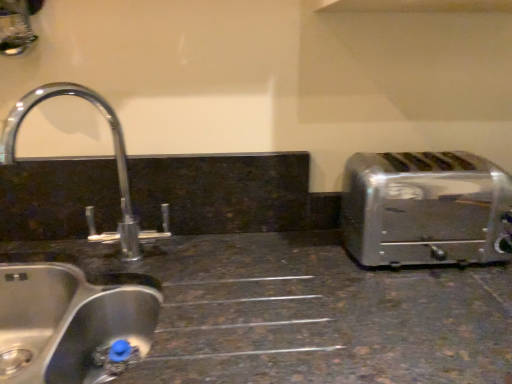
This screenshot has width=512, height=384. Describe the element at coordinates (425, 209) in the screenshot. I see `satin silver toaster at right` at that location.

The height and width of the screenshot is (384, 512). Identify the location of satin silver toaster at right. (425, 209).

Considering the positions of objects stainless steel sink at lower left, the 2th sink viewed from the top, and satin silver toaster at right in the image provided, who is more to the left, stainless steel sink at lower left, the 2th sink viewed from the top, or satin silver toaster at right?

Positioned to the left is stainless steel sink at lower left, the 2th sink viewed from the top.

Who is bigger, stainless steel sink at lower left, which is the first sink in bottom-to-top order, or satin silver toaster at right?

Bigger between the two is stainless steel sink at lower left, which is the first sink in bottom-to-top order.

Which of these two, stainless steel sink at lower left, the 2th sink viewed from the top, or satin silver toaster at right, stands taller?

stainless steel sink at lower left, the 2th sink viewed from the top, is taller.

Is brushed metal sink at left, which is the first sink in top-to-bottom order, outside of stainless steel sink at lower left, which is the first sink in bottom-to-top order?

brushed metal sink at left, which is the first sink in top-to-bottom order, lies outside stainless steel sink at lower left, which is the first sink in bottom-to-top order,'s area.

From the image's perspective, who appears lower, brushed metal sink at left, which is the first sink in top-to-bottom order, or stainless steel sink at lower left, which is the first sink in bottom-to-top order?

stainless steel sink at lower left, which is the first sink in bottom-to-top order, is shown below in the image.

Which object is thinner, brushed metal sink at left, arranged as the 2th sink when ordered from the bottom, or stainless steel sink at lower left, the 2th sink viewed from the top?

Thinner between the two is brushed metal sink at left, arranged as the 2th sink when ordered from the bottom.

How far apart are brushed metal sink at left, arranged as the 2th sink when ordered from the bottom, and stainless steel sink at lower left, which is the first sink in bottom-to-top order?

brushed metal sink at left, arranged as the 2th sink when ordered from the bottom, and stainless steel sink at lower left, which is the first sink in bottom-to-top order, are 1.48 inches apart from each other.

Measure the distance between satin silver toaster at right and stainless steel sink at lower left, which is the first sink in bottom-to-top order.

The distance of satin silver toaster at right from stainless steel sink at lower left, which is the first sink in bottom-to-top order, is 23.37 inches.

Is satin silver toaster at right next to stainless steel sink at lower left, the 2th sink viewed from the top?

satin silver toaster at right and stainless steel sink at lower left, the 2th sink viewed from the top, are not in contact.

Is satin silver toaster at right closer to camera compared to stainless steel sink at lower left, which is the first sink in bottom-to-top order?

No, satin silver toaster at right is behind stainless steel sink at lower left, which is the first sink in bottom-to-top order.

From a real-world perspective, between satin silver toaster at right and stainless steel sink at lower left, which is the first sink in bottom-to-top order, who is vertically lower?

From a 3D spatial view, stainless steel sink at lower left, which is the first sink in bottom-to-top order, is below.

Where is `sink lying above the stainless steel sink at lower left, the 2th sink viewed from the top (from the image's perspective)`? sink lying above the stainless steel sink at lower left, the 2th sink viewed from the top (from the image's perspective) is located at coordinates (70, 325).

Measure the distance between stainless steel sink at lower left, the 2th sink viewed from the top, and brushed metal sink at left, arranged as the 2th sink when ordered from the bottom.

1.48 inches.

From the picture: Who is more distant, stainless steel sink at lower left, the 2th sink viewed from the top, or brushed metal sink at left, arranged as the 2th sink when ordered from the bottom?

Positioned behind is brushed metal sink at left, arranged as the 2th sink when ordered from the bottom.

Is stainless steel sink at lower left, which is the first sink in bottom-to-top order, looking in the opposite direction of brushed metal sink at left, which is the first sink in top-to-bottom order?

That's not correct — stainless steel sink at lower left, which is the first sink in bottom-to-top order, is not looking away from brushed metal sink at left, which is the first sink in top-to-bottom order.

Is brushed metal sink at left, arranged as the 2th sink when ordered from the bottom, next to satin silver toaster at right and touching it?

No, brushed metal sink at left, arranged as the 2th sink when ordered from the bottom, is not with satin silver toaster at right.

Which of these two, brushed metal sink at left, arranged as the 2th sink when ordered from the bottom, or satin silver toaster at right, is thinner?

brushed metal sink at left, arranged as the 2th sink when ordered from the bottom.

Between point (11, 126) and point (421, 226), which one is positioned behind?

The point (421, 226) is farther.

Considering the sizes of objects satin silver toaster at right and brushed metal sink at left, arranged as the 2th sink when ordered from the bottom, in the image provided, who is shorter, satin silver toaster at right or brushed metal sink at left, arranged as the 2th sink when ordered from the bottom,?

satin silver toaster at right is shorter.

Find the location of a particular element. Image resolution: width=512 pixels, height=384 pixels. the 1st sink to the left when counting from the satin silver toaster at right is located at coordinates (70, 325).

Is satin silver toaster at right turned away from brushed metal sink at left, which is the first sink in top-to-bottom order?

No, satin silver toaster at right is not facing away from brushed metal sink at left, which is the first sink in top-to-bottom order.

I want to click on sink located underneath the satin silver toaster at right (from a real-world perspective), so click(x=73, y=323).

The width and height of the screenshot is (512, 384). What are the coordinates of `sink on the right of stainless steel sink at lower left, which is the first sink in bottom-to-top order` in the screenshot? It's located at (70, 325).

Which object lies further to the anchor point brushed metal sink at left, arranged as the 2th sink when ordered from the bottom, stainless steel sink at lower left, the 2th sink viewed from the top, or satin silver toaster at right?

satin silver toaster at right is further to brushed metal sink at left, arranged as the 2th sink when ordered from the bottom.

Estimate the real-world distances between objects in this image. Which object is further from brushed metal sink at left, arranged as the 2th sink when ordered from the bottom, satin silver toaster at right or stainless steel sink at lower left, which is the first sink in bottom-to-top order?

The object further to brushed metal sink at left, arranged as the 2th sink when ordered from the bottom, is satin silver toaster at right.

Looking at the image, which one is located closer to stainless steel sink at lower left, which is the first sink in bottom-to-top order, brushed metal sink at left, arranged as the 2th sink when ordered from the bottom, or satin silver toaster at right?

brushed metal sink at left, arranged as the 2th sink when ordered from the bottom.

Based on their spatial positions, is satin silver toaster at right or brushed metal sink at left, arranged as the 2th sink when ordered from the bottom, closer to stainless steel sink at lower left, the 2th sink viewed from the top?

brushed metal sink at left, arranged as the 2th sink when ordered from the bottom, is positioned closer to the anchor stainless steel sink at lower left, the 2th sink viewed from the top.

Which object lies nearer to the anchor point satin silver toaster at right, stainless steel sink at lower left, the 2th sink viewed from the top, or brushed metal sink at left, arranged as the 2th sink when ordered from the bottom?

The object closer to satin silver toaster at right is stainless steel sink at lower left, the 2th sink viewed from the top.

Looking at the image, which one is located closer to satin silver toaster at right, brushed metal sink at left, which is the first sink in top-to-bottom order, or stainless steel sink at lower left, which is the first sink in bottom-to-top order?

The object closer to satin silver toaster at right is stainless steel sink at lower left, which is the first sink in bottom-to-top order.

You are a GUI agent. You are given a task and a screenshot of the screen. Output one action in this format:
    pyautogui.click(x=<x>, y=<y>)
    Task: Click on the sink between stainless steel sink at lower left, which is the first sink in bottom-to-top order, and satin silver toaster at right, in the horizontal direction
    
    Given the screenshot: What is the action you would take?
    pyautogui.click(x=70, y=325)